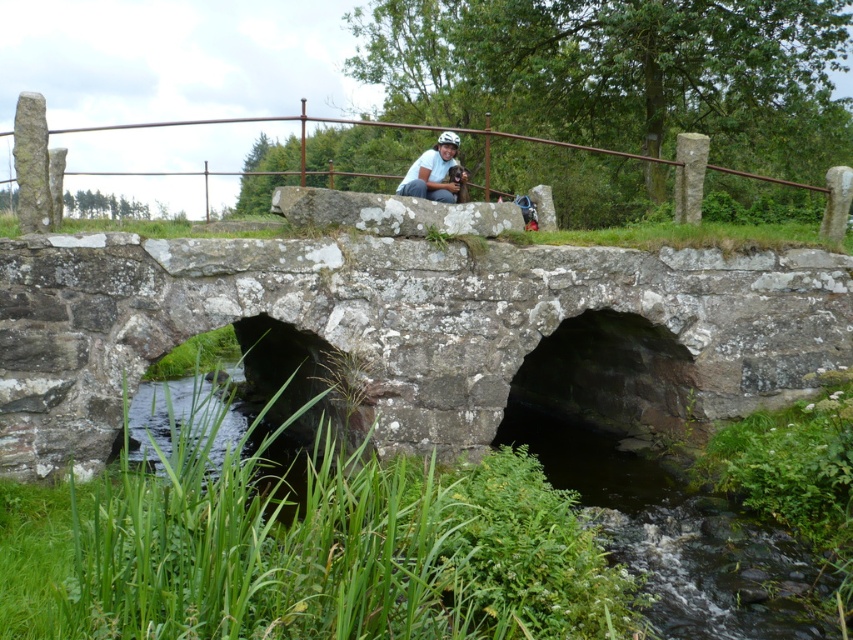
Question: Which of the following is the farthest from the observer?

Choices:
 (A) metallic brown rail at upper center
 (B) rusty stone bridge at center
 (C) matte white helmet at center

Answer: (C)

Question: Which point is farther to the camera?

Choices:
 (A) (33, 332)
 (B) (323, 172)
 (C) (453, 141)

Answer: (B)

Question: Which point appears farthest from the camera in this image?

Choices:
 (A) (442, 193)
 (B) (33, 148)
 (C) (276, 365)

Answer: (C)

Question: Considering the relative positions of rusty stone bridge at center and matte white helmet at center in the image provided, where is rusty stone bridge at center located with respect to matte white helmet at center?

Choices:
 (A) left
 (B) right

Answer: (A)

Question: Is the position of rusty stone bridge at center more distant than that of matte white helmet at center?

Choices:
 (A) no
 (B) yes

Answer: (A)

Question: In this image, where is metallic brown rail at upper center located relative to matte white helmet at center?

Choices:
 (A) right
 (B) left

Answer: (B)